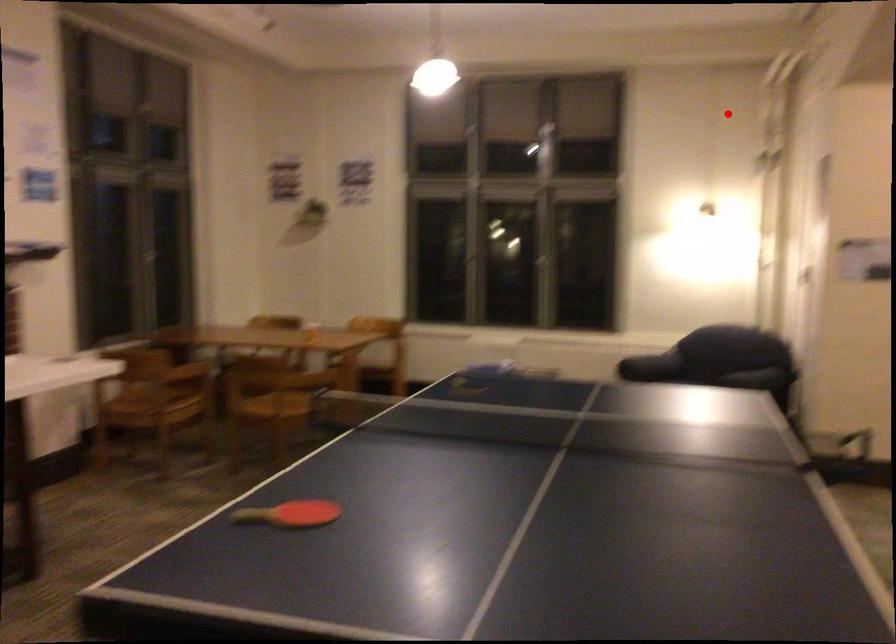
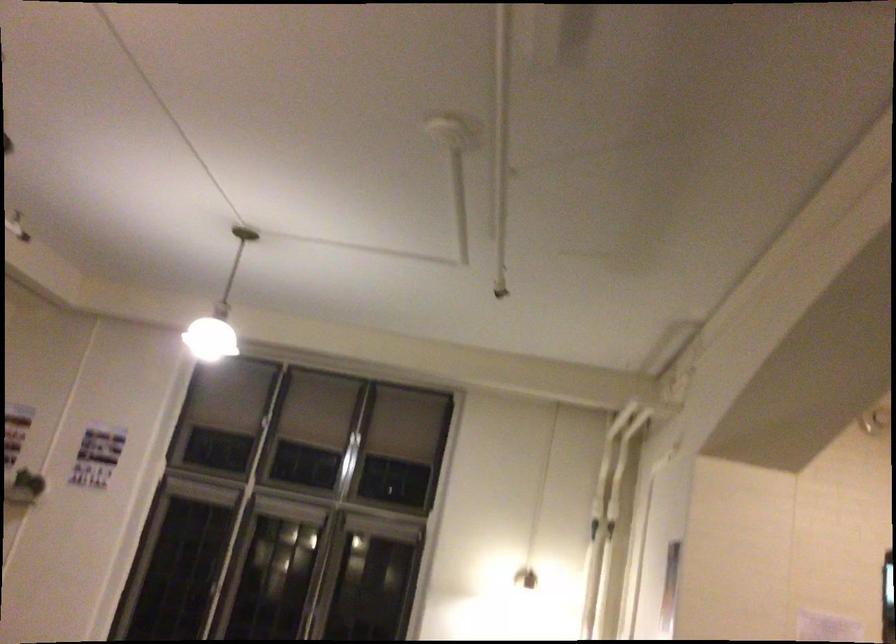
In the second image, find the point that corresponds to the highlighted location in the first image.

(588, 529)